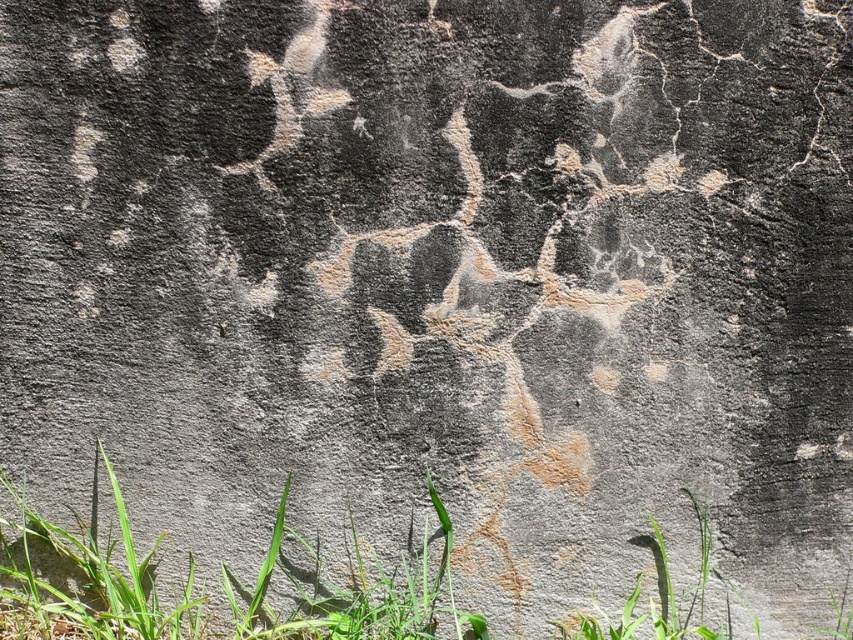
Question: Does green grass at lower left have a larger size compared to green leafy grass at bottom?

Choices:
 (A) no
 (B) yes

Answer: (B)

Question: Which of the following is the closest to the observer?

Choices:
 (A) green leafy grass at bottom
 (B) green grass at lower left

Answer: (B)

Question: Can you confirm if green grass at lower left is positioned to the left of green leafy grass at bottom?

Choices:
 (A) no
 (B) yes

Answer: (B)

Question: Which point is farther from the camera taking this photo?

Choices:
 (A) 177,630
 (B) 709,632

Answer: (B)

Question: Which point is closer to the camera?

Choices:
 (A) green leafy grass at bottom
 (B) green grass at lower left

Answer: (B)

Question: Is green grass at lower left wider than green leafy grass at bottom?

Choices:
 (A) yes
 (B) no

Answer: (A)